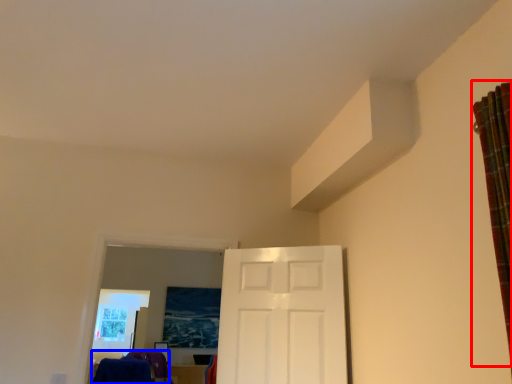
Question: Which object appears farthest to the camera in this image, curtain (highlighted by a red box) or laundry (highlighted by a blue box)?

Choices:
 (A) curtain
 (B) laundry

Answer: (B)